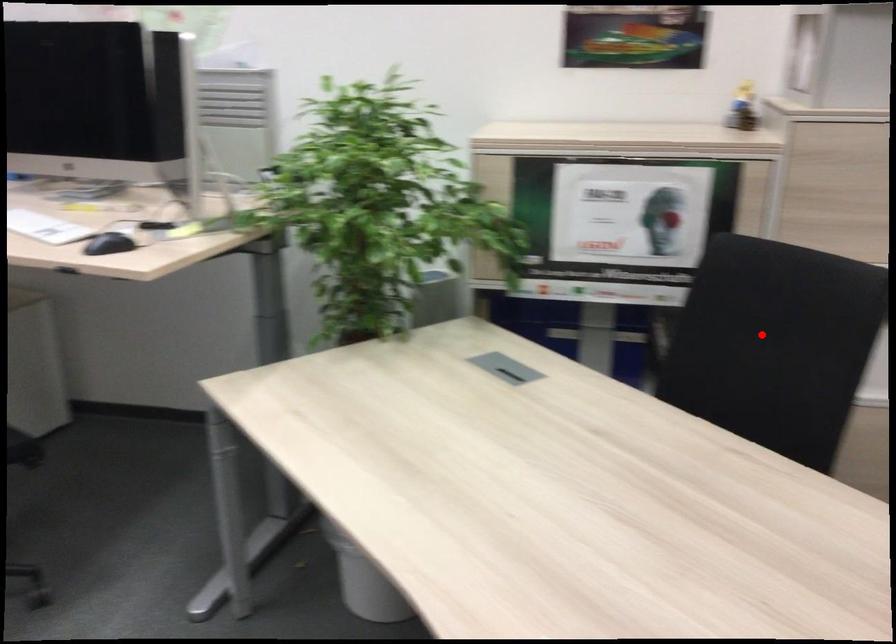
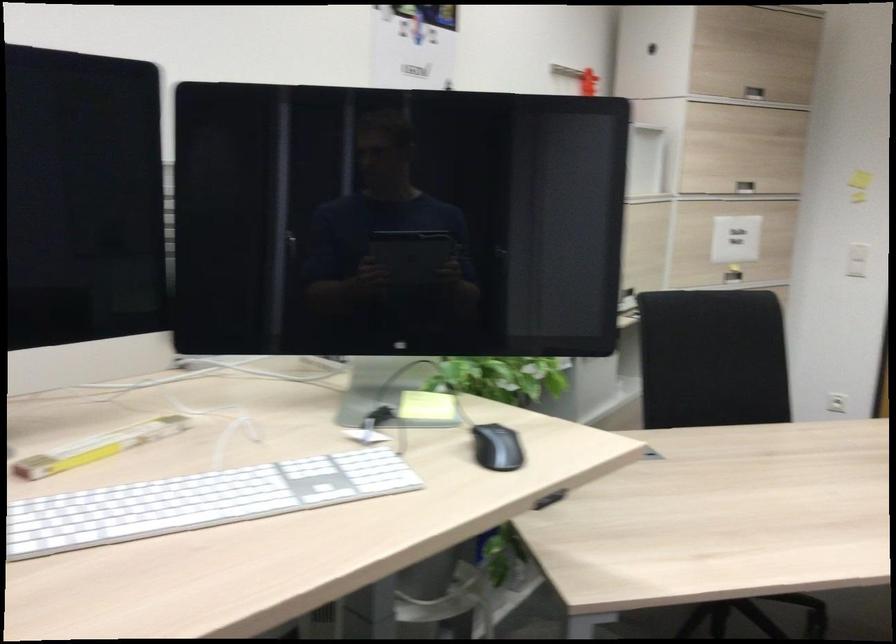
Where in the second image is the point corresponding to the highlighted location from the first image?

(712, 359)